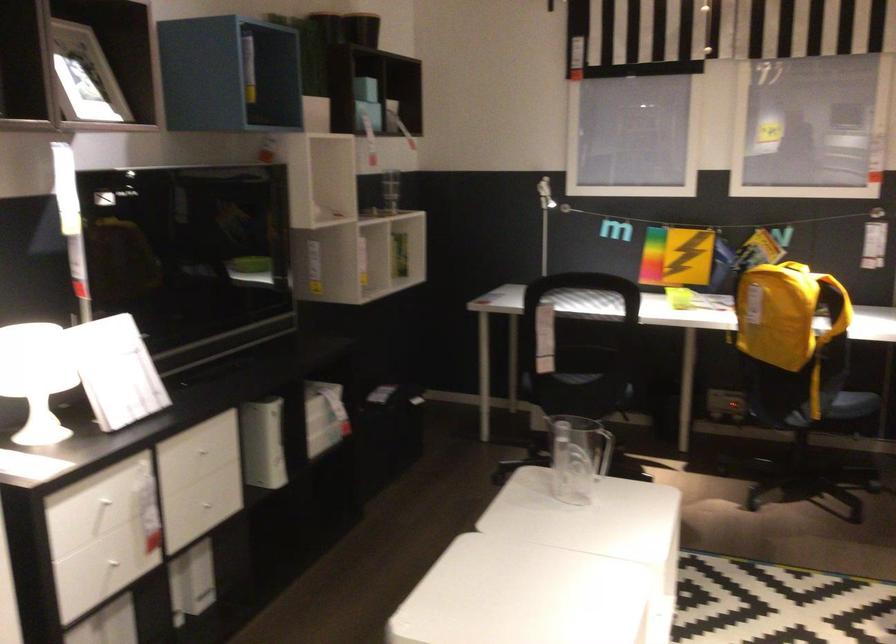
Find where to lift the clear pitcher handle. Please return your answer as a coordinate pair (x, y).

(607, 451)